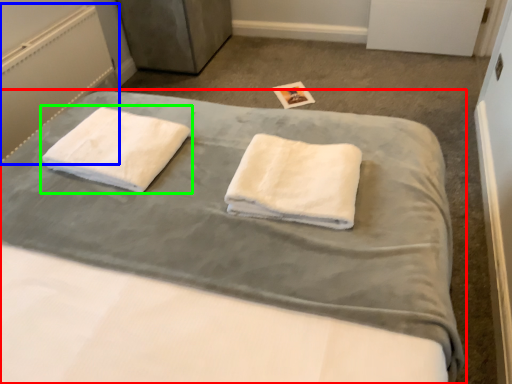
Question: Which object is positioned farthest from bed (highlighted by a red box)? Select from radiator (highlighted by a blue box) and towel (highlighted by a green box).

Choices:
 (A) radiator
 (B) towel

Answer: (A)